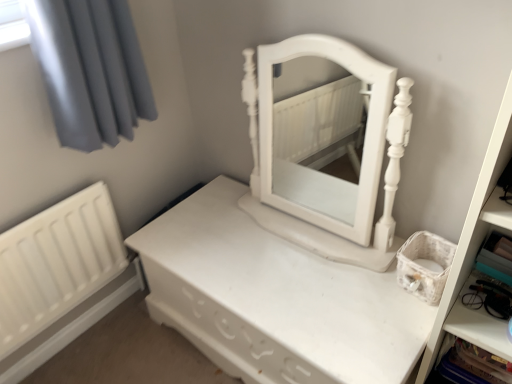
Where is `free space above white matte/wooden nightstand at center (from a real-world perspective)`? This screenshot has width=512, height=384. free space above white matte/wooden nightstand at center (from a real-world perspective) is located at coordinates (293, 257).